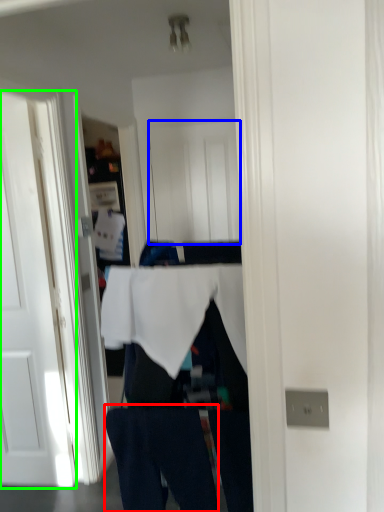
Question: Which is nearer to the jeans (highlighted by a red box)? door (highlighted by a blue box) or door (highlighted by a green box).

Choices:
 (A) door
 (B) door

Answer: (B)